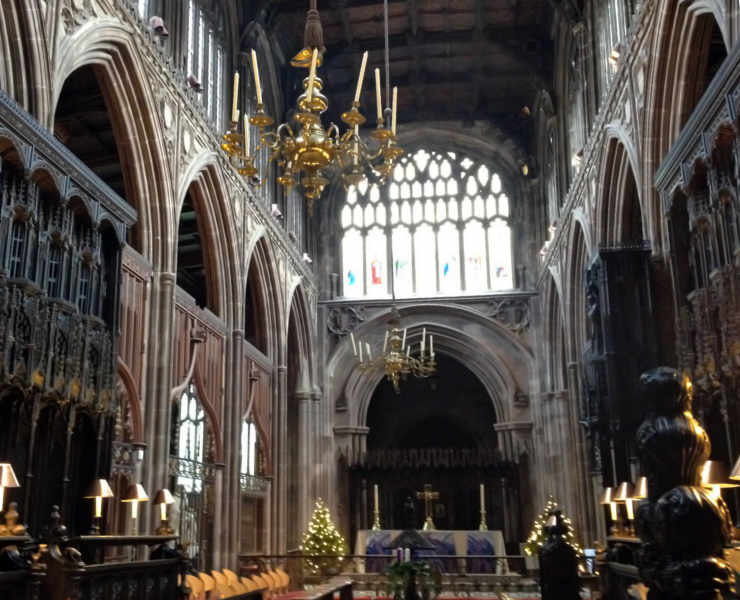
This screenshot has height=600, width=740. I want to click on candelabra, so click(x=306, y=130), click(x=394, y=358).